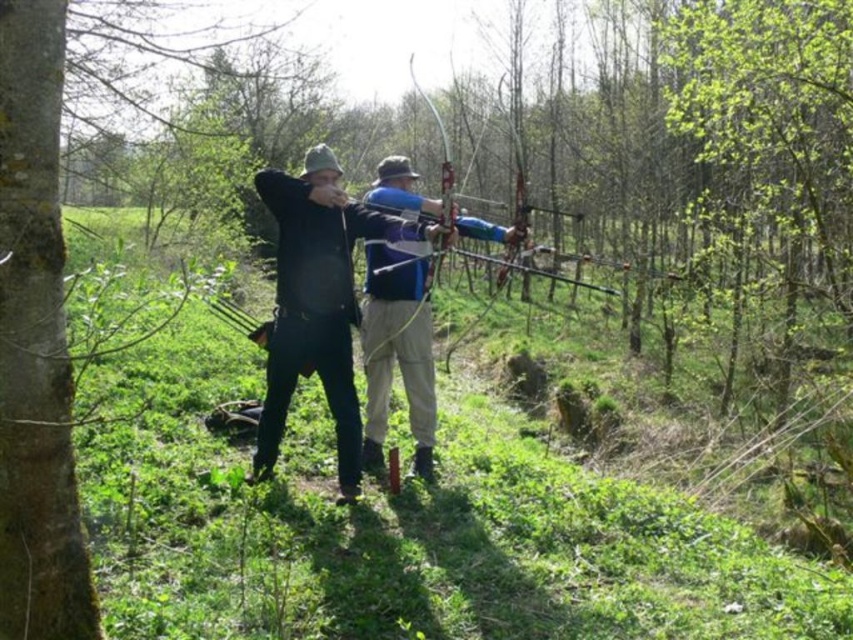
Question: Does black matte jacket at center have a larger size compared to blue fabric bow at center?

Choices:
 (A) no
 (B) yes

Answer: (B)

Question: Among these points, which one is farthest from the camera?

Choices:
 (A) (386, 380)
 (B) (351, 275)

Answer: (A)

Question: Observing the image, what is the correct spatial positioning of blue fabric bow at center in reference to matte blue bow at center?

Choices:
 (A) above
 (B) below

Answer: (B)

Question: Which object is farther from the camera taking this photo?

Choices:
 (A) blue fabric bow at center
 (B) matte blue bow at center

Answer: (A)

Question: Is blue fabric bow at center positioned behind matte blue bow at center?

Choices:
 (A) yes
 (B) no

Answer: (A)

Question: Considering the real-world distances, which object is farthest from the blue fabric bow at center?

Choices:
 (A) black matte jacket at center
 (B) matte blue bow at center

Answer: (B)